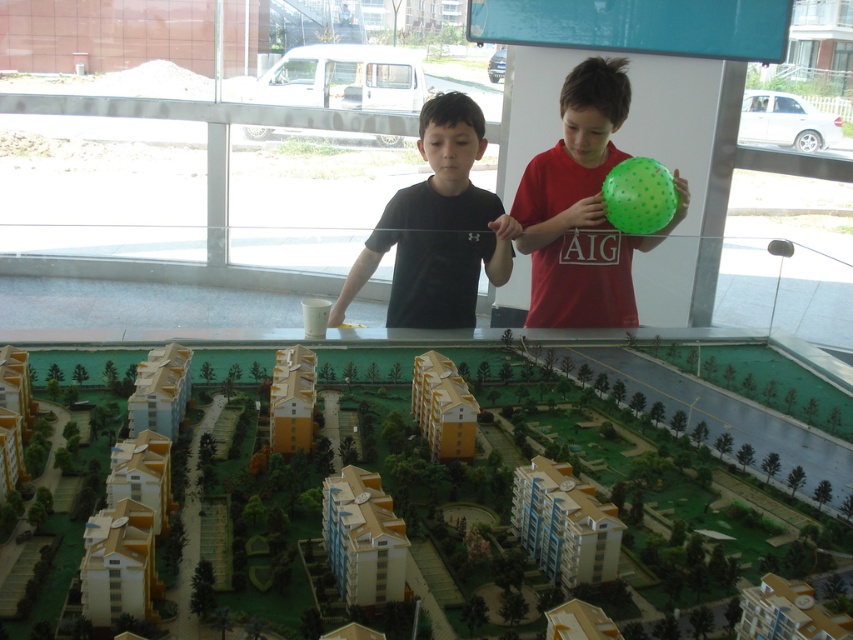
Question: Which point is farther from the camera taking this photo?

Choices:
 (A) (581, 300)
 (B) (471, 262)

Answer: (A)

Question: Can you confirm if green dotted balloon at center is bigger than black matte shirt at center?

Choices:
 (A) yes
 (B) no

Answer: (A)

Question: Among these objects, which one is nearest to the camera?

Choices:
 (A) green dotted balloon at center
 (B) black matte shirt at center

Answer: (B)

Question: Is green dotted balloon at center closer to camera compared to black matte shirt at center?

Choices:
 (A) yes
 (B) no

Answer: (B)

Question: Where is green dotted balloon at center located in relation to black matte shirt at center in the image?

Choices:
 (A) left
 (B) right

Answer: (B)

Question: Which of the following is the farthest from the observer?

Choices:
 (A) black matte shirt at center
 (B) green dotted balloon at center

Answer: (B)